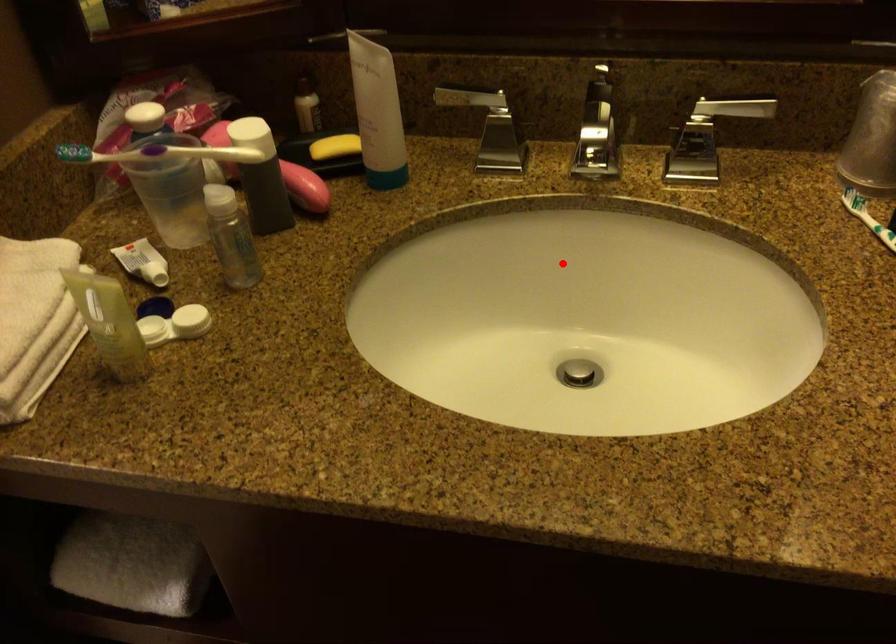
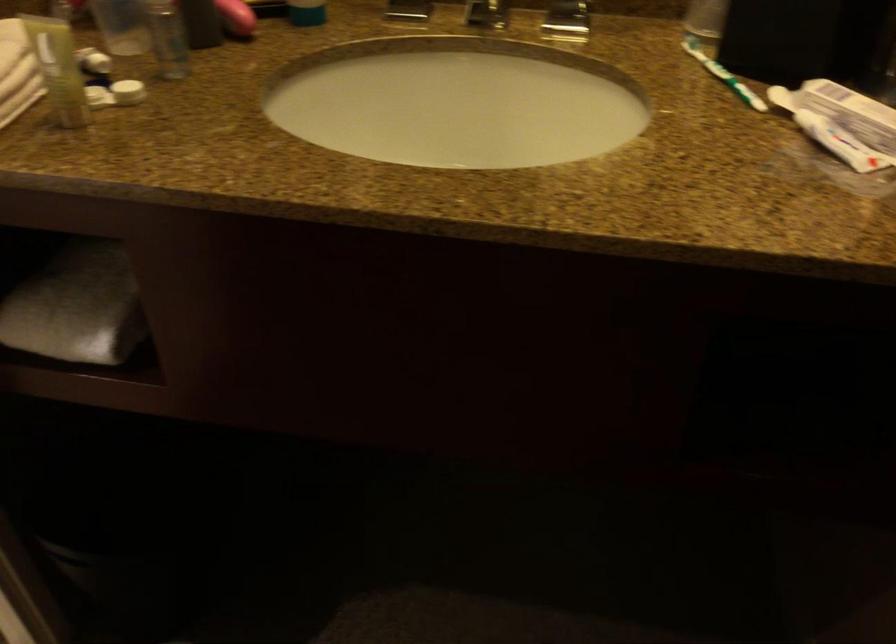
Question: I am providing you with two images of the same scene from different viewpoints. Image1 has a red point marked. In image2, the corresponding 3D location appears at what relative position? Reply with the corresponding letter.

Choices:
 (A) Closer
 (B) Farther

Answer: (B)